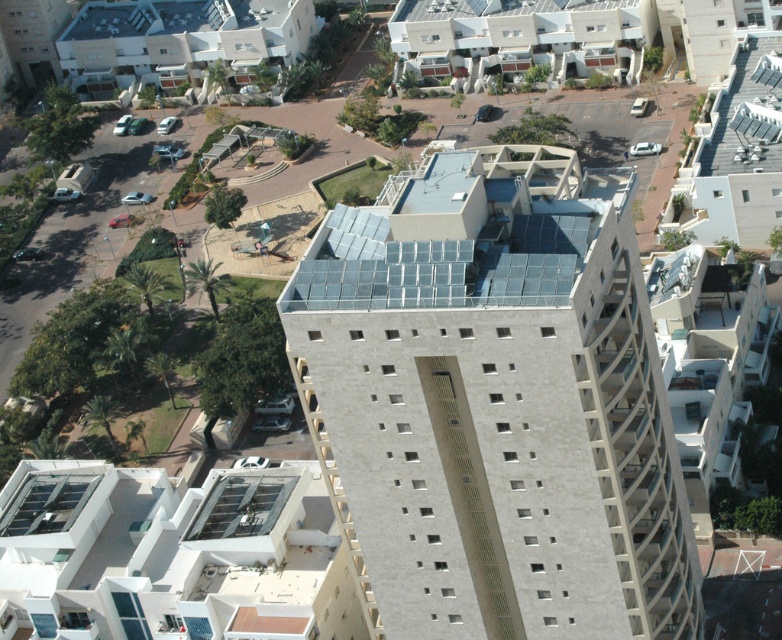
Question: Which of the following is the closest to the observer?

Choices:
 (A) (45, 19)
 (B) (153, 621)

Answer: (B)

Question: Which object is positioned farthest from the beige concrete hotel at upper center?

Choices:
 (A) beige concrete building at upper center
 (B) white matte building at lower left

Answer: (B)

Question: From the image, what is the correct spatial relationship of white matte building at lower left in relation to beige concrete hotel at upper center?

Choices:
 (A) below
 (B) above

Answer: (A)

Question: Observing the image, what is the correct spatial positioning of white matte building at lower left in reference to beige concrete hotel at upper center?

Choices:
 (A) below
 (B) above

Answer: (A)

Question: Which is nearer to the white matte building at lower left?

Choices:
 (A) beige concrete building at upper center
 (B) beige concrete hotel at upper center
 (C) smooth concrete building at center

Answer: (C)

Question: Does smooth concrete building at center have a smaller size compared to beige concrete hotel at upper center?

Choices:
 (A) yes
 (B) no

Answer: (B)